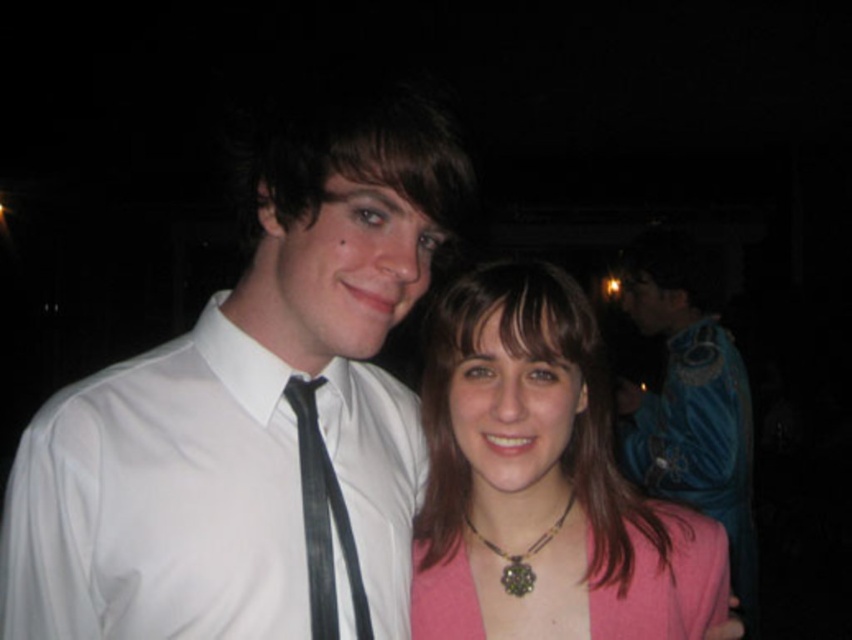
What is the object located at the coordinates point (323, 518) in the image?

The object located at point (323, 518) is the black satin tie at center.

You are standing in front of the two people in the photo. If you want to walk directly towards the person on the right, which of the two points, point (439, 394) or point (330, 484), should you aim for?

You should aim for point (330, 484) because it is in front of point (439, 394).

You are a photographer trying to adjust the lighting for a photo of the two people in the image. You notice a light source at point (542, 483). Which person should you position closer to this light source to illuminate their clothing better?

The light source at point (542, 483) is positioned at the pink fabric at center, so you should position the individual on the right wearing the pink top closer to this light source to better illuminate their clothing.